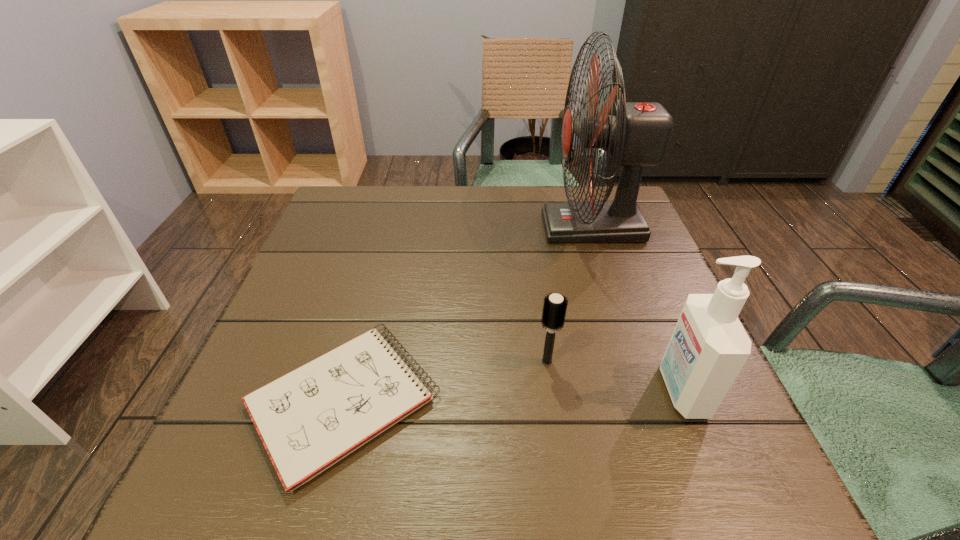
You are a GUI agent. You are given a task and a screenshot of the screen. Output one action in this format:
    pyautogui.click(x=<x>, y=<y>)
    Task: Click on the object located in the near left corner section of the desktop
    
    Given the screenshot: What is the action you would take?
    pyautogui.click(x=309, y=419)

You are a GUI agent. You are given a task and a screenshot of the screen. Output one action in this format:
    pyautogui.click(x=<x>, y=<y>)
    Task: Click on the object present at the far right corner
    This screenshot has width=960, height=540.
    Given the screenshot: What is the action you would take?
    pyautogui.click(x=636, y=134)

The image size is (960, 540). In the image, there is a desktop. Identify the location of vacant space at the far edge. (384, 221).

In the image, there is a desktop. Where is `vacant region at the left edge`? The image size is (960, 540). vacant region at the left edge is located at coordinates (334, 270).

In the image, there is a desktop. Identify the location of free space at the right edge. This screenshot has height=540, width=960. (656, 447).

Locate an element on the screen. The image size is (960, 540). free space at the far left corner of the desktop is located at coordinates (341, 231).

Where is `vacant space at the far right corner of the desktop`? This screenshot has width=960, height=540. vacant space at the far right corner of the desktop is located at coordinates (609, 188).

Image resolution: width=960 pixels, height=540 pixels. Identify the location of free space between the leftmost object and the fan. (468, 314).

Image resolution: width=960 pixels, height=540 pixels. I want to click on free space between the notepad and the fan, so click(x=468, y=314).

The width and height of the screenshot is (960, 540). I want to click on blank region between the shortest object and the fan, so click(468, 314).